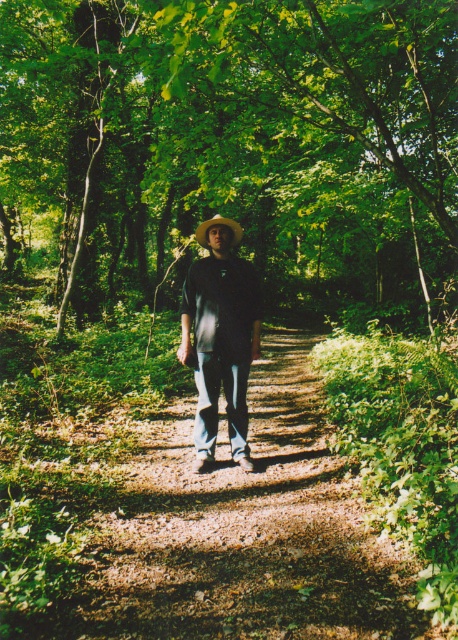
Question: Is green leafy tree at center bigger than matte black shirt at center?

Choices:
 (A) yes
 (B) no

Answer: (A)

Question: Can you confirm if green leafy tree at center is thinner than brown straw cowboy hat at center?

Choices:
 (A) yes
 (B) no

Answer: (B)

Question: Which object appears farthest from the camera in this image?

Choices:
 (A) green leafy tree at center
 (B) matte black shirt at center
 (C) brown straw cowboy hat at center

Answer: (C)

Question: Which object is the closest to the green leafy tree at center?

Choices:
 (A) brown straw cowboy hat at center
 (B) matte black shirt at center

Answer: (B)

Question: Is green leafy tree at center smaller than matte black shirt at center?

Choices:
 (A) yes
 (B) no

Answer: (B)

Question: Which point is closer to the camera?

Choices:
 (A) green leafy tree at center
 (B) matte black shirt at center
 (C) brown straw cowboy hat at center

Answer: (A)